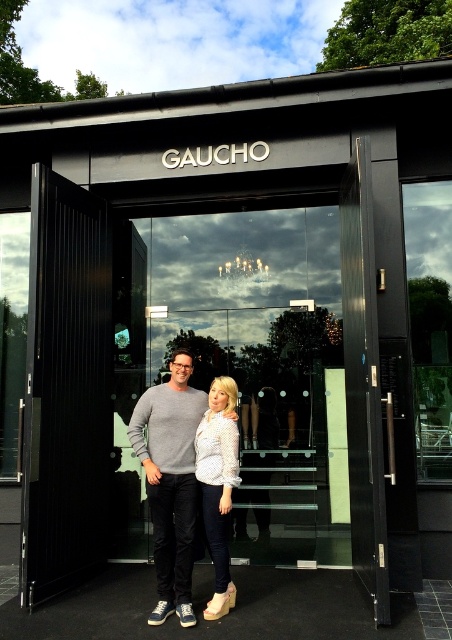
You are a delivery person trying to enter the building through the entrance. You see the transparent glass door at center and the white dotted shirt at center. Which object is closer to your right side?

The transparent glass door at center is positioned on the right side of white dotted shirt at center, so it is closer to your right side.

You are standing in front of the GAUCHO building entrance and see two points marked on the glass doors. The first point is at coordinate point (193, 467) and the second point is at coordinate point (229, 433). Which point is closer to the entrance doors?

Point (229, 433) is closer to the entrance doors because it is closer to the viewer than point (193, 467), which is further away.